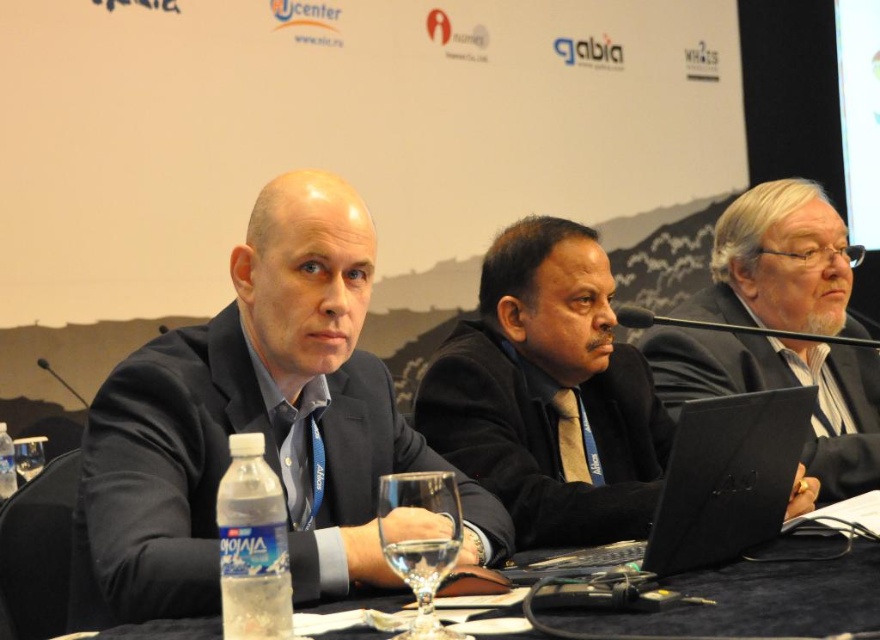
Question: Is the position of black matte laptop at center more distant than that of clear plastic bottle at lower left?

Choices:
 (A) yes
 (B) no

Answer: (A)

Question: Where is black matte laptop at center located in relation to clear plastic bottle at center in the image?

Choices:
 (A) above
 (B) below

Answer: (A)

Question: Observing the image, what is the correct spatial positioning of clear plastic water bottle at center in reference to clear plastic bottle at lower left?

Choices:
 (A) left
 (B) right

Answer: (B)

Question: Which point is closer to the camera taking this photo?

Choices:
 (A) (560, 410)
 (B) (743, 563)
 (C) (796, 440)

Answer: (B)

Question: Which object is closer to the camera taking this photo?

Choices:
 (A) dark brown textured tie at center
 (B) clear plastic bottle at center
 (C) clear plastic bottle at lower left
 (D) black matte laptop at center

Answer: (C)

Question: Considering the real-world distances, which object is closest to the black matte suit at center?

Choices:
 (A) black glossy suit at center
 (B) clear plastic bottle at lower left
 (C) clear plastic bottle at center
 (D) gray matte suit at right

Answer: (A)